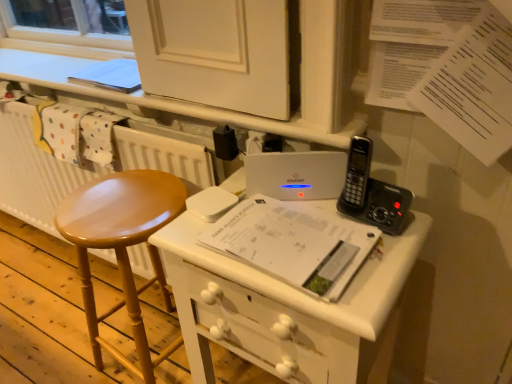
What are the coordinates of `unoccupied area in front of black plastic phone at upper right` in the screenshot? It's located at (377, 266).